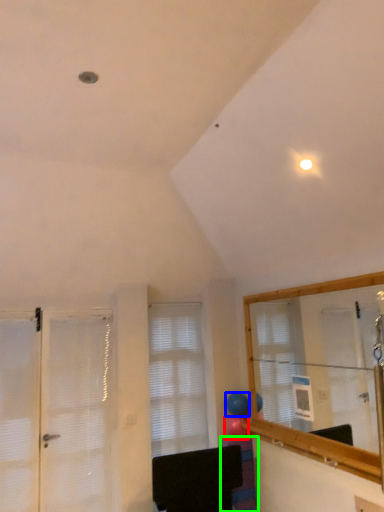
Question: Based on their relative distances, which object is nearer to balloon (highlighted by a red box)? Choose from balloon (highlighted by a blue box) and furniture (highlighted by a green box).

Choices:
 (A) balloon
 (B) furniture

Answer: (A)